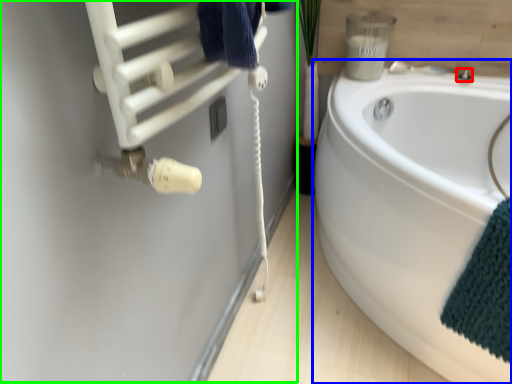
Question: Estimate the real-world distances between objects in this image. Which object is farther from faucet (highlighted by a red box), bathtub (highlighted by a blue box) or wool (highlighted by a green box)?

Choices:
 (A) bathtub
 (B) wool

Answer: (B)